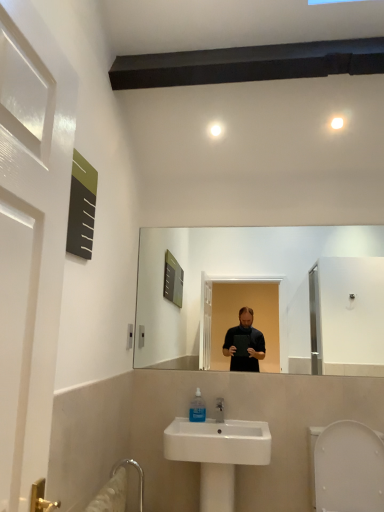
Question: Is white ceramic sink at lower center taller or shorter than translucent plastic mouthwash at sink?

Choices:
 (A) short
 (B) tall

Answer: (B)

Question: From a real-world perspective, is white ceramic sink at lower center above or below translucent plastic mouthwash at sink?

Choices:
 (A) below
 (B) above

Answer: (A)

Question: Considering the real-world distances, which object is closest to the white plastic bidet at lower right?

Choices:
 (A) white ceramic sink at lower center
 (B) translucent plastic mouthwash at sink

Answer: (A)

Question: Which object is positioned farthest from the white plastic bidet at lower right?

Choices:
 (A) translucent plastic mouthwash at sink
 (B) white ceramic sink at lower center

Answer: (A)